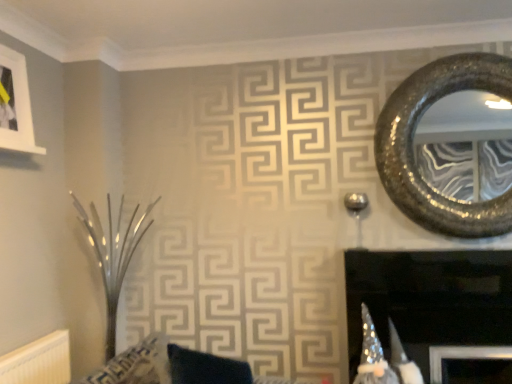
Find the location of `white textured radiator at lower left`. white textured radiator at lower left is located at coordinates (38, 361).

Locate an element on the screen. The height and width of the screenshot is (384, 512). sparkly metallic mirror at upper right is located at coordinates (413, 143).

Does black glossy fireplace at center turn towards sparkly metallic mirror at upper right?

No.

Considering the relative positions of black glossy fireplace at center and sparkly metallic mirror at upper right in the image provided, is black glossy fireplace at center to the left of sparkly metallic mirror at upper right from the viewer's perspective?

Yes.

Considering the points (408, 337) and (500, 64), which point is in front, point (408, 337) or point (500, 64)?

Point (500, 64)

Identify the location of fireplace that appears below the sparkly metallic mirror at upper right (from the image's perspective). (429, 300).

Is black glossy fireplace at center in front of velvet dark blue cushion at center?

No, the depth of black glossy fireplace at center is greater than that of velvet dark blue cushion at center.

In the scene shown: Which object is positioned more to the right, black glossy fireplace at center or velvet dark blue cushion at center?

black glossy fireplace at center.

How many degrees apart are the facing directions of black glossy fireplace at center and velvet dark blue cushion at center?

The angular difference between black glossy fireplace at center and velvet dark blue cushion at center is 73.8 degrees.

From the image's perspective, is black glossy fireplace at center located beneath velvet dark blue cushion at center?

No, from the image's perspective, black glossy fireplace at center is not beneath velvet dark blue cushion at center.

Is black glossy fireplace at center placed right next to white textured radiator at lower left?

black glossy fireplace at center and white textured radiator at lower left are clearly separated.

Is black glossy fireplace at center positioned beyond the bounds of white textured radiator at lower left?

Yes, black glossy fireplace at center is located beyond the bounds of white textured radiator at lower left.

Does black glossy fireplace at center have a lesser width compared to white textured radiator at lower left?

No, black glossy fireplace at center is not thinner than white textured radiator at lower left.

Is black glossy fireplace at center aimed at white textured radiator at lower left?

No, black glossy fireplace at center does not turn towards white textured radiator at lower left.

From a real-world perspective, which is physically below, sparkly metallic mirror at upper right or black glossy fireplace at center?

From a 3D spatial view, black glossy fireplace at center is below.

Considering the sizes of objects sparkly metallic mirror at upper right and black glossy fireplace at center in the image provided, who is smaller, sparkly metallic mirror at upper right or black glossy fireplace at center?

sparkly metallic mirror at upper right is smaller.

Would you say sparkly metallic mirror at upper right is outside black glossy fireplace at center?

Yes.

From the image's perspective, is velvet dark blue cushion at center located beneath white textured radiator at lower left?

No, from the image's perspective, velvet dark blue cushion at center is not beneath white textured radiator at lower left.

In terms of width, does velvet dark blue cushion at center look wider or thinner when compared to white textured radiator at lower left?

In the image, velvet dark blue cushion at center appears to be wider than white textured radiator at lower left.

Which point is more distant from viewer, (179, 364) or (36, 356)?

Point (36, 356)

Is white matte picture frame at upper left positioned far away from velvet dark blue cushion at center?

That's right, there is a large distance between white matte picture frame at upper left and velvet dark blue cushion at center.

Could you tell me if white matte picture frame at upper left is facing velvet dark blue cushion at center?

No, white matte picture frame at upper left does not turn towards velvet dark blue cushion at center.

Which is nearer, (x=0, y=129) or (x=122, y=354)?

Point (x=0, y=129) is closer to the camera than point (x=122, y=354).

Looking at this image, considering the relative sizes of white matte picture frame at upper left and velvet dark blue cushion at center in the image provided, is white matte picture frame at upper left smaller than velvet dark blue cushion at center?

Yes.

Identify the location of fireplace in front of the white matte picture frame at upper left. (429, 300).

Which object is wider, white matte picture frame at upper left or black glossy fireplace at center?

black glossy fireplace at center.

Is white matte picture frame at upper left oriented away from black glossy fireplace at center?

No, white matte picture frame at upper left is not facing the opposite direction of black glossy fireplace at center.

From a real-world perspective, which object stands above the other?

white matte picture frame at upper left, from a real-world perspective.

Where is `fireplace in front of the sparkly metallic mirror at upper right`? This screenshot has height=384, width=512. fireplace in front of the sparkly metallic mirror at upper right is located at coordinates [429, 300].

Identify the location of furniture that appears below the black glossy fireplace at center (from a real-world perspective). (173, 367).

Looking at the image, which one is located further to white textured radiator at lower left, white matte picture frame at upper left or black glossy fireplace at center?

black glossy fireplace at center lies further to white textured radiator at lower left than the other object.

Considering their positions, is sparkly metallic mirror at upper right positioned closer to white matte picture frame at upper left than black glossy fireplace at center?

sparkly metallic mirror at upper right is closer to white matte picture frame at upper left.

Based on their spatial positions, is sparkly metallic mirror at upper right or white matte picture frame at upper left further from velvet dark blue cushion at center?

Among the two, sparkly metallic mirror at upper right is located further to velvet dark blue cushion at center.

When comparing their distances from black glossy fireplace at center, does white textured radiator at lower left or velvet dark blue cushion at center seem closer?

velvet dark blue cushion at center lies closer to black glossy fireplace at center than the other object.

Looking at the image, which one is located closer to white matte picture frame at upper left, sparkly metallic mirror at upper right or white textured radiator at lower left?

The object closer to white matte picture frame at upper left is white textured radiator at lower left.

Estimate the real-world distances between objects in this image. Which object is further from sparkly metallic mirror at upper right, white matte picture frame at upper left or black glossy fireplace at center?

white matte picture frame at upper left is positioned further to the anchor sparkly metallic mirror at upper right.

Considering their positions, is white textured radiator at lower left positioned closer to velvet dark blue cushion at center than white matte picture frame at upper left?

white textured radiator at lower left lies closer to velvet dark blue cushion at center than the other object.

Based on their spatial positions, is sparkly metallic mirror at upper right or black glossy fireplace at center closer to velvet dark blue cushion at center?

→ black glossy fireplace at center is positioned closer to the anchor velvet dark blue cushion at center.

Where is `furniture between white matte picture frame at upper left and white textured radiator at lower left from top to bottom`? The width and height of the screenshot is (512, 384). furniture between white matte picture frame at upper left and white textured radiator at lower left from top to bottom is located at coordinates (173, 367).

Where is `fireplace located between white matte picture frame at upper left and sparkly metallic mirror at upper right in the left-right direction`? The width and height of the screenshot is (512, 384). fireplace located between white matte picture frame at upper left and sparkly metallic mirror at upper right in the left-right direction is located at coordinates (429, 300).

The width and height of the screenshot is (512, 384). Find the location of `fireplace between white textured radiator at lower left and sparkly metallic mirror at upper right`. fireplace between white textured radiator at lower left and sparkly metallic mirror at upper right is located at coordinates (x=429, y=300).

This screenshot has width=512, height=384. I want to click on furniture between white textured radiator at lower left and sparkly metallic mirror at upper right, so click(173, 367).